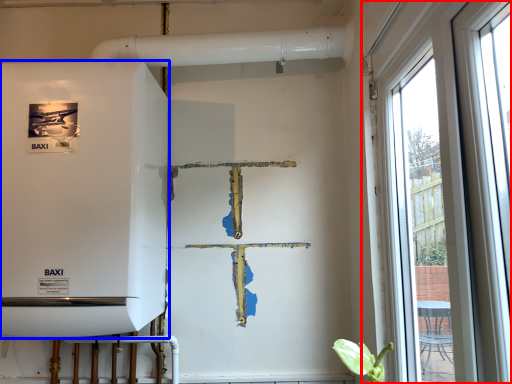
Question: Among these objects, which one is nearest to the camera, window (highlighted by a red box) or appliance (highlighted by a blue box)?

Choices:
 (A) window
 (B) appliance

Answer: (A)